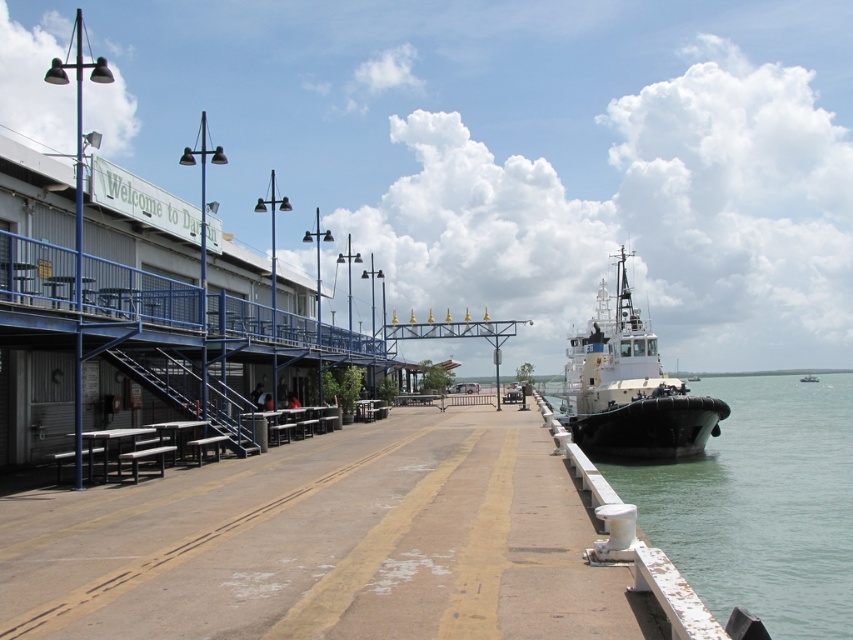
Can you confirm if brown concrete dock at center is positioned to the left of greenish water at lower right?

Indeed, brown concrete dock at center is positioned on the left side of greenish water at lower right.

Describe the element at coordinates (343, 545) in the screenshot. This screenshot has width=853, height=640. I see `brown concrete dock at center` at that location.

Does point (310, 609) lie behind point (746, 483)?

No.

At what (x,y) coordinates should I click in order to perform the action: click on brown concrete dock at center. Please return your answer as a coordinate pair (x, y). Looking at the image, I should click on tap(343, 545).

Does point (763, 579) come in front of point (676, 403)?

Yes, point (763, 579) is in front of point (676, 403).

Where is `greenish water at lower right`? This screenshot has height=640, width=853. greenish water at lower right is located at coordinates (759, 502).

Is the position of brown concrete dock at center more distant than that of white matte tugboat at right?

No.

Who is higher up, brown concrete dock at center or white matte tugboat at right?

Positioned higher is white matte tugboat at right.

Identify the location of brown concrete dock at center. This screenshot has height=640, width=853. (343, 545).